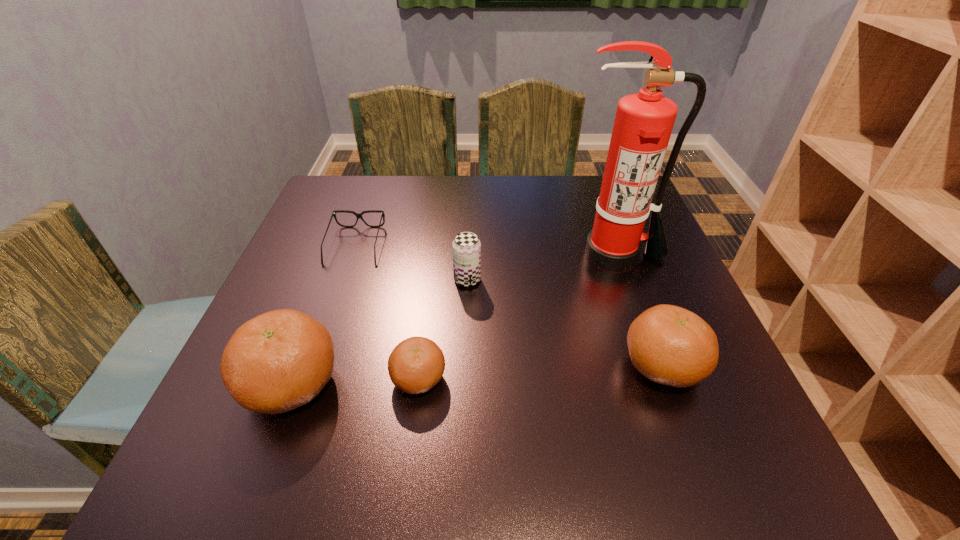
Where is `blank space at the left edge`? Image resolution: width=960 pixels, height=540 pixels. blank space at the left edge is located at coordinates (347, 289).

Locate an element on the screen. This screenshot has height=540, width=960. blank space at the right edge is located at coordinates (684, 305).

In order to click on free location at the far left corner of the desktop in this screenshot , I will do `click(346, 193)`.

The height and width of the screenshot is (540, 960). I want to click on free space at the near right corner, so click(691, 421).

Locate an element on the screen. This screenshot has height=540, width=960. empty location between the second shortest object and the shortest object is located at coordinates (387, 312).

Identify the location of free point between the second tallest clementine and the fifth tallest object. The width and height of the screenshot is (960, 540). (540, 373).

Where is `free space that is in between the fourth object from left to right and the shortest object`? free space that is in between the fourth object from left to right and the shortest object is located at coordinates click(412, 262).

Where is `vacant area that lies between the leftmost clementine and the third object from left to right`? The image size is (960, 540). vacant area that lies between the leftmost clementine and the third object from left to right is located at coordinates (355, 381).

At what (x,y) coordinates should I click in order to perform the action: click on free spot between the second clementine from left to right and the beer can. Please return your answer as a coordinate pair (x, y). This screenshot has width=960, height=540. Looking at the image, I should click on (443, 329).

This screenshot has height=540, width=960. In order to click on free space between the third object from right to left and the spectacles in this screenshot , I will do `click(412, 262)`.